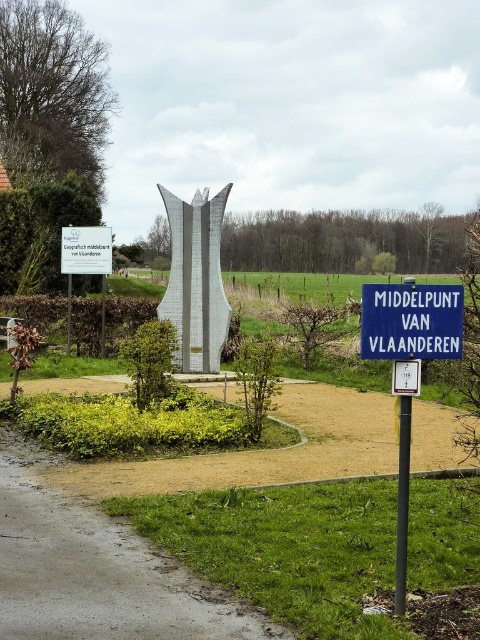
Is silver metallic sculpture at center to the left of satin silver sculpture at center from the viewer's perspective?

Yes, silver metallic sculpture at center is to the left of satin silver sculpture at center.

Who is more distant from viewer, (218, 616) or (196, 189)?

The point (196, 189) is more distant.

Find the location of a particular element. The image size is (480, 640). silver metallic sculpture at center is located at coordinates (141, 540).

Can you confirm if silver metallic sculpture at center is taller than blue plastic sign at center?

Incorrect, silver metallic sculpture at center's height is not larger of blue plastic sign at center's.

Who is higher up, silver metallic sculpture at center or blue plastic sign at center?

blue plastic sign at center is above.

Does point (361, 444) come in front of point (372, 349)?

That is False.

Locate an element on the screen. The image size is (480, 640). silver metallic sculpture at center is located at coordinates (141, 540).

Looking at this image, is silver metallic sculpture at center smaller than white plastic parking sign at center?

No, silver metallic sculpture at center is not smaller than white plastic parking sign at center.

Is point (314, 408) positioned after point (408, 372)?

Yes, point (314, 408) is farther from viewer.

Identify the location of silver metallic sculpture at center. (141, 540).